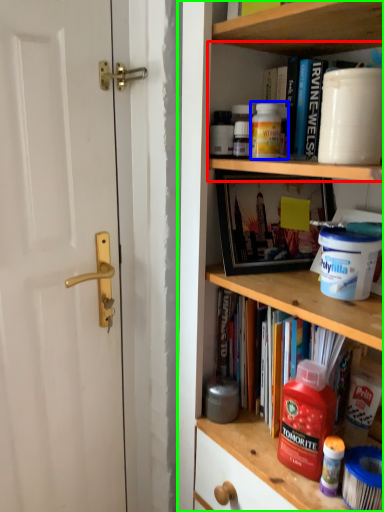
Question: Which is farther away from cabinet (highlighted by a red box)? cleaning product (highlighted by a blue box) or shelf (highlighted by a green box)?

Choices:
 (A) cleaning product
 (B) shelf

Answer: (B)